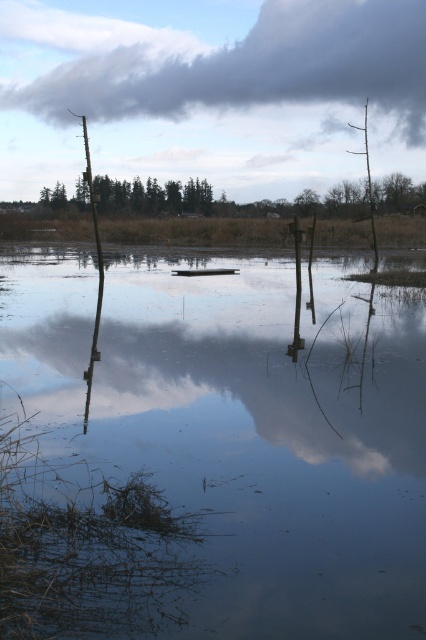
Based on the scene, where is the smooth reflective water at center located in relation to the cloudy gray cloud at upper center?

The smooth reflective water at center is to the right of the cloudy gray cloud at upper center.

Looking at this image, you are standing at the edge of the wetland and want to reach the point marked as point (69, 330). If your walking speed is 1.5 meters per second, how long will it take you to reach that point?

The point (69, 330) is 15.56 meters from camera. At a speed of 1.5 meters per second, it would take approximately 10.37 seconds to reach the point.

You are an artist trying to paint this wetland scene. You want to ensure the smooth reflective water at center and cloudy gray cloud at upper center are proportionally accurate. Which object should you paint first to maintain the correct size relationship between them?

You should paint the cloudy gray cloud at upper center first because the smooth reflective water at center is smaller than it, so starting with the larger object ensures proper scaling when adding the smaller one.